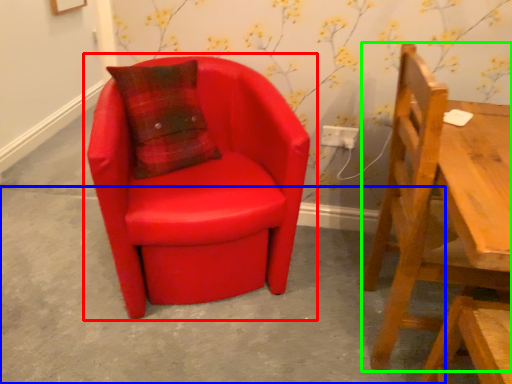
Question: Which is nearer to the chair (highlighted by a red box)? concrete (highlighted by a blue box) or chair (highlighted by a green box).

Choices:
 (A) concrete
 (B) chair

Answer: (A)